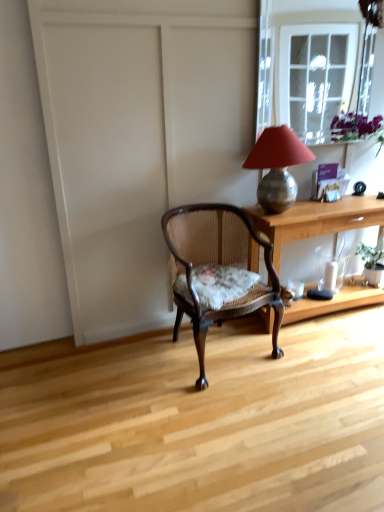
The image size is (384, 512). What are the coordinates of `unoccupied area in front of wooden desk at center` in the screenshot? It's located at (322, 371).